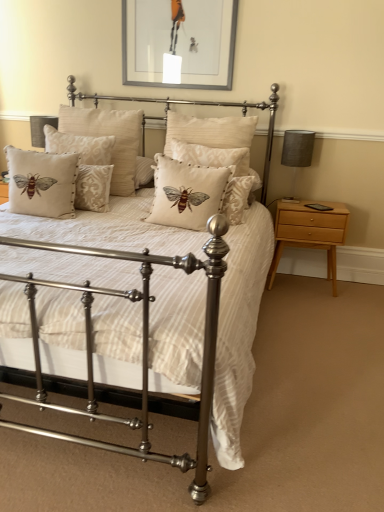
Question: From the image's perspective, is beige fabric cushion with embroidered bee at center, which is counted as the 1th pillow, starting from the right, located above light wood/finish nightstand at right?

Choices:
 (A) yes
 (B) no

Answer: (A)

Question: Considering the relative sizes of beige fabric cushion with embroidered bee at center, positioned as the fifth pillow in left-to-right order, and light wood/finish nightstand at right in the image provided, is beige fabric cushion with embroidered bee at center, positioned as the fifth pillow in left-to-right order, wider than light wood/finish nightstand at right?

Choices:
 (A) no
 (B) yes

Answer: (A)

Question: Is beige fabric cushion with embroidered bee at center, which is counted as the 1th pillow, starting from the right, positioned with its back to light wood/finish nightstand at right?

Choices:
 (A) yes
 (B) no

Answer: (B)

Question: Is beige fabric cushion with embroidered bee at center, positioned as the fifth pillow in left-to-right order, not inside light wood/finish nightstand at right?

Choices:
 (A) yes
 (B) no

Answer: (A)

Question: Does beige fabric cushion with embroidered bee at center, which is counted as the 1th pillow, starting from the right, appear on the left side of light wood/finish nightstand at right?

Choices:
 (A) no
 (B) yes

Answer: (B)

Question: Is beige fabric cushion with embroidered bee at center, positioned as the fifth pillow in left-to-right order, far from light wood/finish nightstand at right?

Choices:
 (A) no
 (B) yes

Answer: (A)

Question: Considering the relative positions of matte silver bed at center and matte gray picture frame at upper center in the image provided, is matte silver bed at center to the left of matte gray picture frame at upper center from the viewer's perspective?

Choices:
 (A) no
 (B) yes

Answer: (B)

Question: Considering the relative sizes of matte silver bed at center and matte gray picture frame at upper center in the image provided, is matte silver bed at center bigger than matte gray picture frame at upper center?

Choices:
 (A) no
 (B) yes

Answer: (B)

Question: Can you confirm if matte silver bed at center is thinner than matte gray picture frame at upper center?

Choices:
 (A) no
 (B) yes

Answer: (A)

Question: From a real-world perspective, is matte silver bed at center physically above matte gray picture frame at upper center?

Choices:
 (A) yes
 (B) no

Answer: (B)

Question: Is matte silver bed at center completely or partially outside of matte gray picture frame at upper center?

Choices:
 (A) no
 (B) yes

Answer: (B)

Question: Does matte silver bed at center have a greater height compared to matte gray picture frame at upper center?

Choices:
 (A) yes
 (B) no

Answer: (A)

Question: Would you say beige fabric cushion with embroidered bee at center, positioned as the 4th pillow in left-to-right order, is part of beige fabric cushion with embroidered bee at left, positioned as the 1th pillow in left-to-right order,'s contents?

Choices:
 (A) yes
 (B) no

Answer: (B)